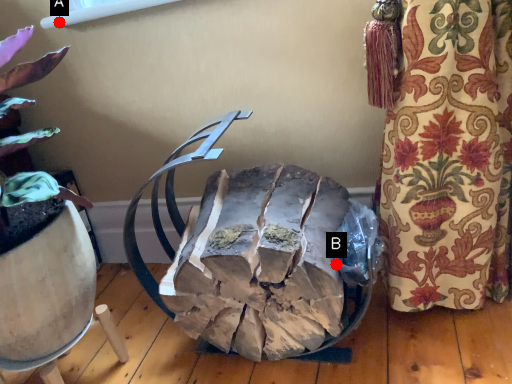
Question: Two points are circled on the image, labeled by A and B beside each circle. Which point is farther from the camera taking this photo?

Choices:
 (A) A is further
 (B) B is further

Answer: (A)